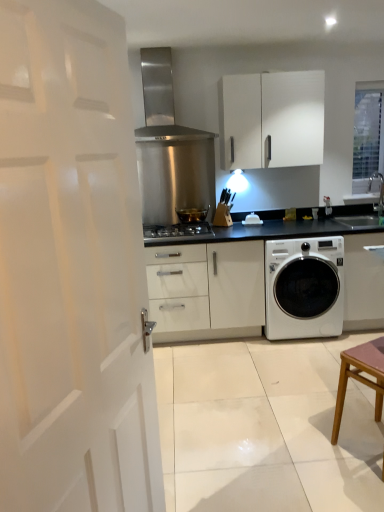
At what (x,y) coordinates should I click in order to perform the action: click on free spot to the left of brown wooden table at lower right. Please return your answer as a coordinate pair (x, y). Looking at the image, I should click on pos(315,463).